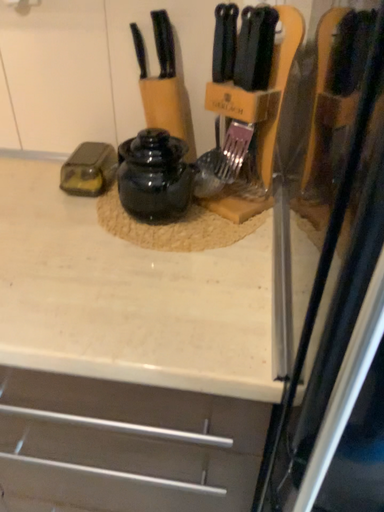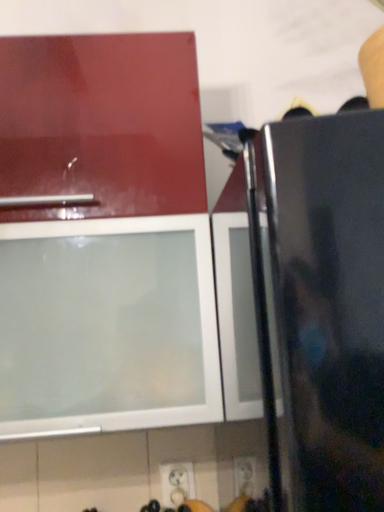
Question: How did the camera likely rotate when shooting the video?

Choices:
 (A) rotated downward
 (B) rotated upward

Answer: (B)